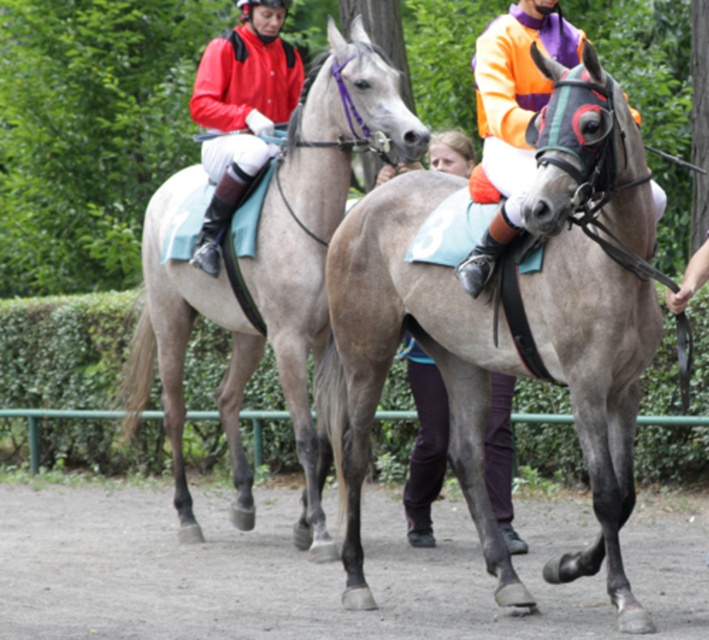
Question: From the image, what is the correct spatial relationship of gray matte horse at center in relation to gray matte/suede horse at left?

Choices:
 (A) left
 (B) right

Answer: (B)

Question: Where is gray matte/suede horse at left located in relation to green leafy hedge at center in the image?

Choices:
 (A) left
 (B) right

Answer: (B)

Question: Which object appears closest to the camera in this image?

Choices:
 (A) green leafy hedge at center
 (B) orange jersey at center
 (C) gray matte horse at center

Answer: (C)

Question: Estimate the real-world distances between objects in this image. Which object is closer to the gray matte horse at center?

Choices:
 (A) green leafy hedge at center
 (B) gray matte/suede horse at left
 (C) orange jersey at center
 (D) matte red jacket at left

Answer: (C)

Question: Which object is positioned closest to the green leafy hedge at center?

Choices:
 (A) gray matte horse at center
 (B) gray matte/suede horse at left
 (C) orange jersey at center

Answer: (B)

Question: Does gray matte horse at center appear on the left side of gray matte/suede horse at left?

Choices:
 (A) yes
 (B) no

Answer: (B)